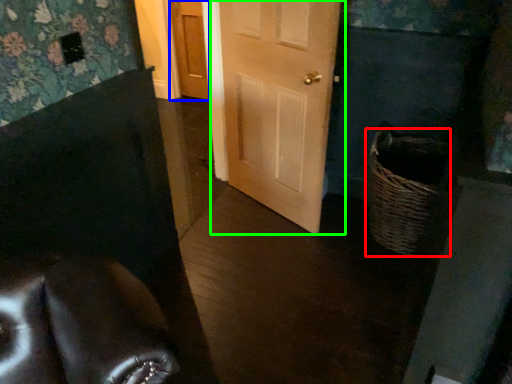
Question: Based on their relative distances, which object is nearer to basket (highlighted by a red box)? Choose from door (highlighted by a blue box) and door (highlighted by a green box).

Choices:
 (A) door
 (B) door

Answer: (B)